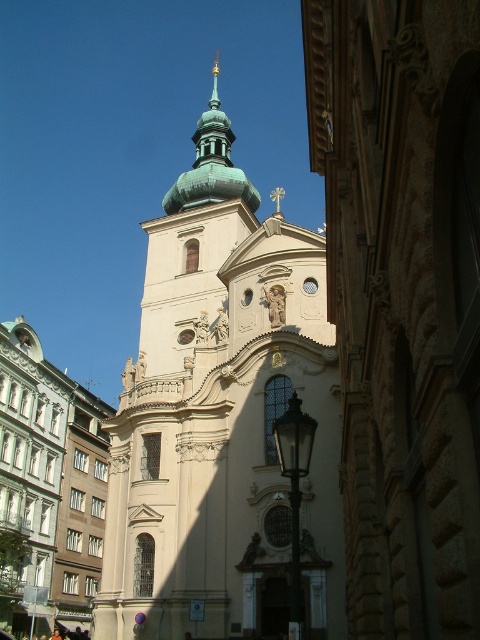
This screenshot has width=480, height=640. What are the coordinates of `green polished spire at upper center` in the screenshot? It's located at (211, 164).

Can you confirm if green polished spire at upper center is positioned above green polished stone spire at upper center?

Actually, green polished spire at upper center is below green polished stone spire at upper center.

Who is more forward, (177,179) or (219,115)?

Positioned in front is point (219,115).

The height and width of the screenshot is (640, 480). Find the location of `green polished spire at upper center`. green polished spire at upper center is located at coordinates (211, 164).

Measure the distance between point (34, 476) and camera.

91.13 meters

Image resolution: width=480 pixels, height=640 pixels. Identify the location of light beige stone church at center. (48, 486).

Between point (333, 376) and point (207, 150), which one is positioned in front?

Point (333, 376) is more forward.

Who is more forward, (314,600) or (210,144)?

Point (314,600) is more forward.

This screenshot has width=480, height=640. In order to click on beige stone tower at center in this screenshot , I will do `click(222, 426)`.